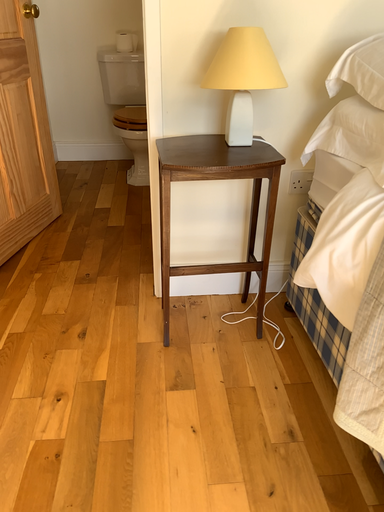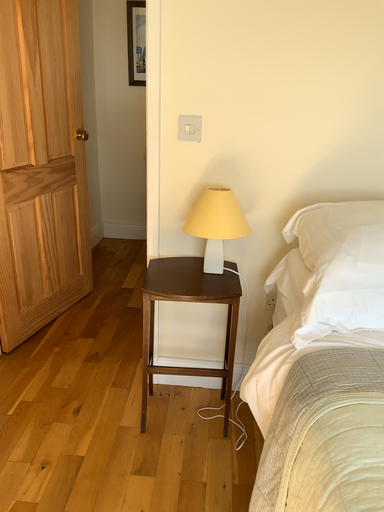
Question: How did the camera likely rotate when shooting the video?

Choices:
 (A) rotated upward
 (B) rotated downward

Answer: (A)